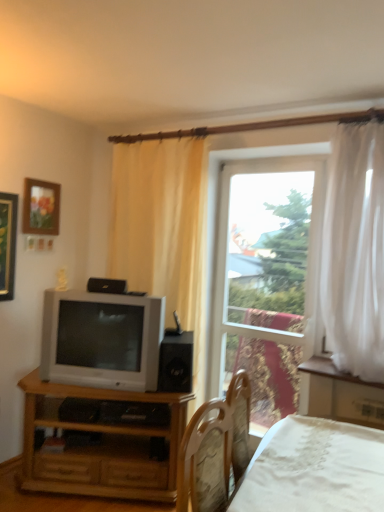
Question: From a real-world perspective, is wooden framed picture at upper left on matte silver television at left?

Choices:
 (A) yes
 (B) no

Answer: (A)

Question: Is wooden framed picture at upper left further to camera compared to matte silver television at left?

Choices:
 (A) no
 (B) yes

Answer: (B)

Question: Is wooden framed picture at upper left at the left side of matte silver television at left?

Choices:
 (A) no
 (B) yes

Answer: (B)

Question: Considering the relative positions of wooden framed picture at upper left and matte silver television at left in the image provided, is wooden framed picture at upper left to the right of matte silver television at left from the viewer's perspective?

Choices:
 (A) yes
 (B) no

Answer: (B)

Question: Is the depth of wooden framed picture at upper left less than that of matte silver television at left?

Choices:
 (A) yes
 (B) no

Answer: (B)

Question: From the image's perspective, is wooden framed picture at upper left above matte silver television at left?

Choices:
 (A) yes
 (B) no

Answer: (A)

Question: Does light brown wood tv stand at lower left have a greater height compared to wooden framed picture at upper left?

Choices:
 (A) no
 (B) yes

Answer: (B)

Question: From the image's perspective, is light brown wood tv stand at lower left beneath wooden framed picture at upper left?

Choices:
 (A) no
 (B) yes

Answer: (B)

Question: Considering the relative sizes of light brown wood tv stand at lower left and wooden framed picture at upper left in the image provided, is light brown wood tv stand at lower left wider than wooden framed picture at upper left?

Choices:
 (A) no
 (B) yes

Answer: (B)

Question: Considering the relative positions of light brown wood tv stand at lower left and wooden framed picture at upper left in the image provided, is light brown wood tv stand at lower left to the right of wooden framed picture at upper left from the viewer's perspective?

Choices:
 (A) yes
 (B) no

Answer: (A)

Question: From a real-world perspective, is light brown wood tv stand at lower left under wooden framed picture at upper left?

Choices:
 (A) yes
 (B) no

Answer: (A)

Question: Is light brown wood tv stand at lower left looking in the opposite direction of wooden framed picture at upper left?

Choices:
 (A) yes
 (B) no

Answer: (B)

Question: Is white lace bed at lower right aimed at light brown wood tv stand at lower left?

Choices:
 (A) yes
 (B) no

Answer: (B)